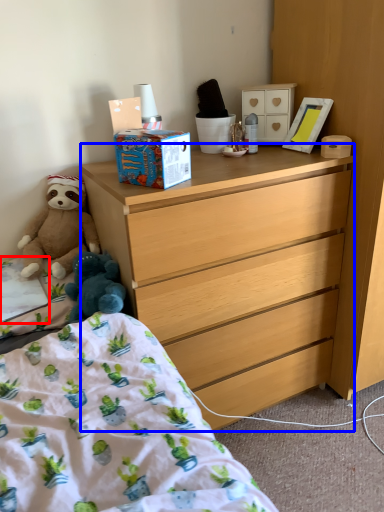
Question: Which of the following is the farthest to the observer, sheet (highlighted by a red box) or desk (highlighted by a blue box)?

Choices:
 (A) sheet
 (B) desk

Answer: (A)